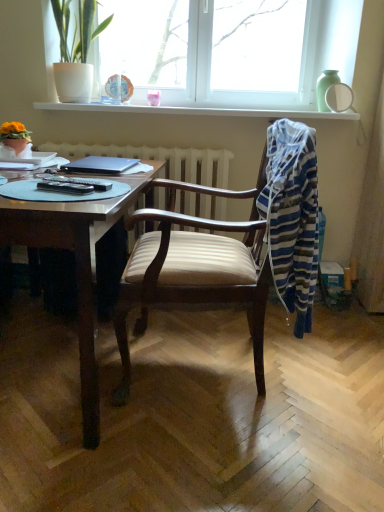
Locate an element on the screen. The height and width of the screenshot is (512, 384). free area below wooden chair at center (from a real-world perspective) is located at coordinates (202, 367).